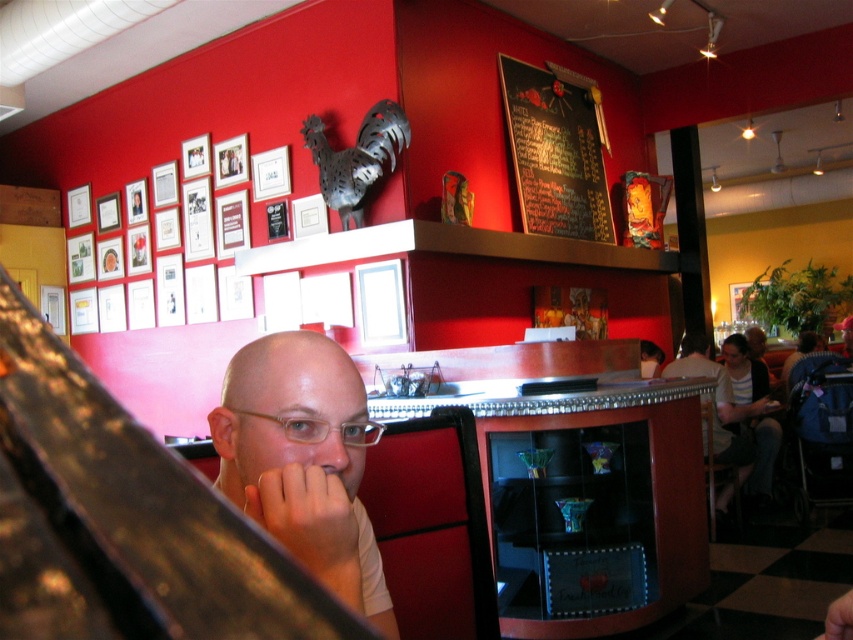
Can you confirm if matte white shirt at center is taller than black chalkboard at upper center?

Incorrect, matte white shirt at center's height is not larger of black chalkboard at upper center's.

Measure the distance between matte white shirt at center and black chalkboard at upper center.

They are 3.95 meters apart.

Between point (293, 490) and point (572, 84), which one is positioned behind?

Positioned behind is point (572, 84).

Locate an element on the screen. This screenshot has height=640, width=853. matte white shirt at center is located at coordinates (303, 460).

Can you confirm if matte white shirt at center is smaller than light skin tone flesh at lower center?

Incorrect, matte white shirt at center is not smaller in size than light skin tone flesh at lower center.

Does matte white shirt at center appear on the left side of light skin tone flesh at lower center?

Indeed, matte white shirt at center is positioned on the left side of light skin tone flesh at lower center.

Image resolution: width=853 pixels, height=640 pixels. Describe the element at coordinates (303, 460) in the screenshot. I see `matte white shirt at center` at that location.

Locate an element on the screen. matte white shirt at center is located at coordinates (303, 460).

Where is `black chalkboard at upper center`? Image resolution: width=853 pixels, height=640 pixels. black chalkboard at upper center is located at coordinates (555, 154).

Between point (537, 97) and point (288, 540), which one is positioned behind?

Point (537, 97)

The image size is (853, 640). Identify the location of black chalkboard at upper center. (555, 154).